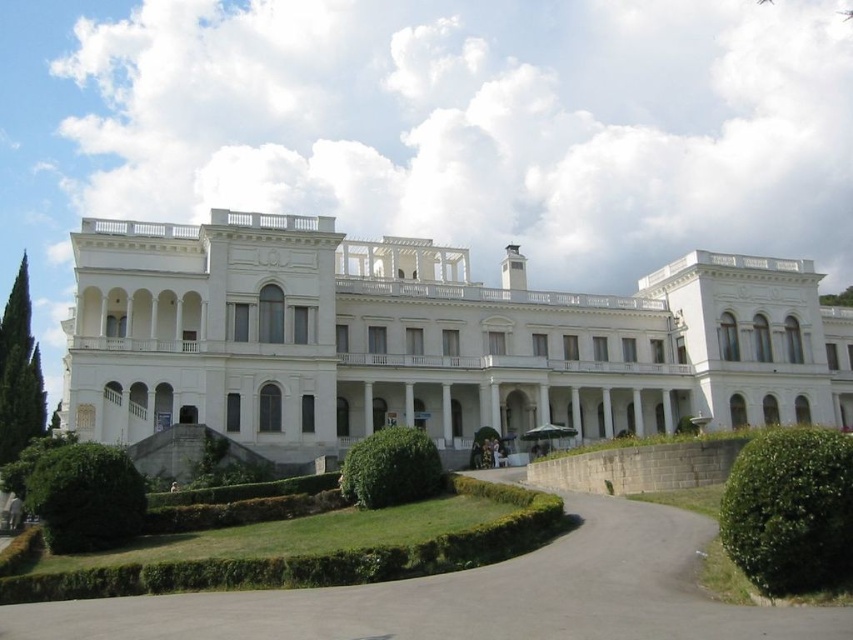
Question: Can you confirm if gray asphalt driveway at lower center is positioned to the right of green leafy hedge at center?

Choices:
 (A) yes
 (B) no

Answer: (A)

Question: Based on their relative distances, which object is nearer to the green leafy hedge at center?

Choices:
 (A) green leafy hedge at lower left
 (B) white stone building at center
 (C) green leafy hedge at lower right
 (D) gray asphalt driveway at lower center

Answer: (A)

Question: Does gray asphalt driveway at lower center have a greater width compared to green leafy hedge at lower right?

Choices:
 (A) yes
 (B) no

Answer: (A)

Question: Considering the real-world distances, which object is farthest from the green leafy hedge at lower left?

Choices:
 (A) white stone building at center
 (B) gray asphalt driveway at lower center

Answer: (A)

Question: Which object appears closest to the camera in this image?

Choices:
 (A) green leafy hedge at lower right
 (B) green leafy hedge at center

Answer: (A)

Question: Does gray asphalt driveway at lower center appear on the left side of green leafy hedge at center?

Choices:
 (A) yes
 (B) no

Answer: (B)